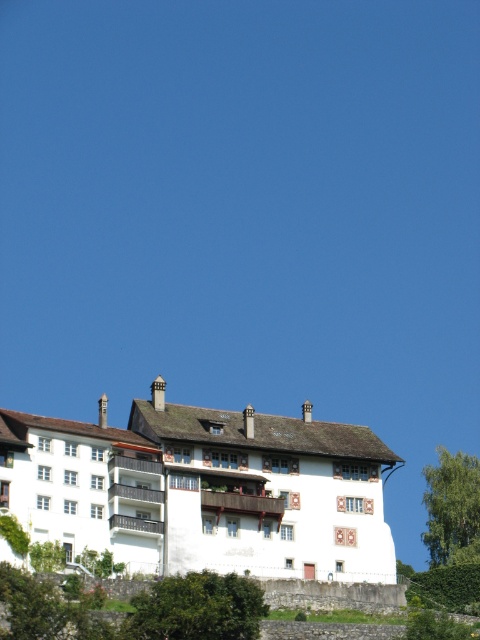
Does green leafy tree at lower center have a greater width compared to green leafy tree at lower right?

In fact, green leafy tree at lower center might be narrower than green leafy tree at lower right.

Between green leafy tree at lower center and green leafy tree at lower right, which one is positioned higher?

Positioned higher is green leafy tree at lower center.

Between point (183, 593) and point (445, 529), which one is positioned behind?

The point (445, 529) is more distant.

Locate an element on the screen. green leafy tree at lower center is located at coordinates (196, 609).